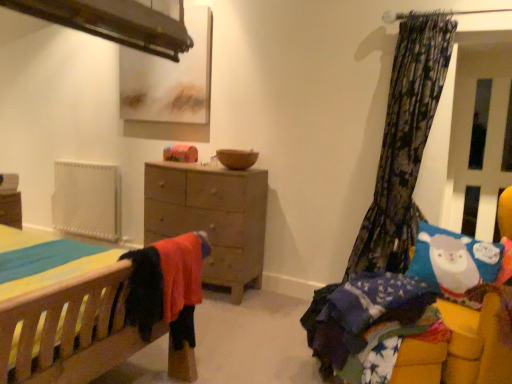
Question: Is brown matte bowl at center outside of transparent plastic screen door at right?

Choices:
 (A) yes
 (B) no

Answer: (A)

Question: Considering the relative positions of brown matte bowl at center and transparent plastic screen door at right in the image provided, is brown matte bowl at center to the right of transparent plastic screen door at right from the viewer's perspective?

Choices:
 (A) no
 (B) yes

Answer: (A)

Question: Is brown matte bowl at center positioned in front of transparent plastic screen door at right?

Choices:
 (A) yes
 (B) no

Answer: (B)

Question: Is transparent plastic screen door at right at the back of brown matte bowl at center?

Choices:
 (A) no
 (B) yes

Answer: (A)

Question: Considering the relative sizes of brown matte bowl at center and transparent plastic screen door at right in the image provided, is brown matte bowl at center taller than transparent plastic screen door at right?

Choices:
 (A) no
 (B) yes

Answer: (A)

Question: Is point (2, 321) closer or farther from the camera than point (233, 165)?

Choices:
 (A) farther
 (B) closer

Answer: (B)

Question: Choose the correct answer: Is wooden bed at lower left, which is the second bed from right to left, inside brown matte bowl at center or outside it?

Choices:
 (A) outside
 (B) inside

Answer: (A)

Question: Is wooden bed at lower left, marked as the 1th bed in a left-to-right arrangement, wider or thinner than brown matte bowl at center?

Choices:
 (A) thin
 (B) wide

Answer: (B)

Question: From their relative heights in the image, would you say wooden bed at lower left, which is the second bed from right to left, is taller or shorter than brown matte bowl at center?

Choices:
 (A) tall
 (B) short

Answer: (B)

Question: From a real-world perspective, is matte brown picture frame at upper center above or below wooden bed at lower left, which is the second bed from right to left?

Choices:
 (A) below
 (B) above

Answer: (B)

Question: From the image's perspective, is matte brown picture frame at upper center positioned above or below wooden bed at lower left, marked as the 1th bed in a left-to-right arrangement?

Choices:
 (A) below
 (B) above

Answer: (B)

Question: Does point (202, 49) appear closer or farther from the camera than point (0, 226)?

Choices:
 (A) closer
 (B) farther

Answer: (B)

Question: Is matte brown picture frame at upper center to the left or to the right of wooden bed at lower left, which is the second bed from right to left, in the image?

Choices:
 (A) left
 (B) right

Answer: (B)

Question: Does point (249, 160) appear closer or farther from the camera than point (16, 296)?

Choices:
 (A) closer
 (B) farther

Answer: (B)

Question: From the image's perspective, relative to wooden bed at lower left, which is the second bed from right to left, is brown matte bowl at center above or below?

Choices:
 (A) below
 (B) above

Answer: (B)